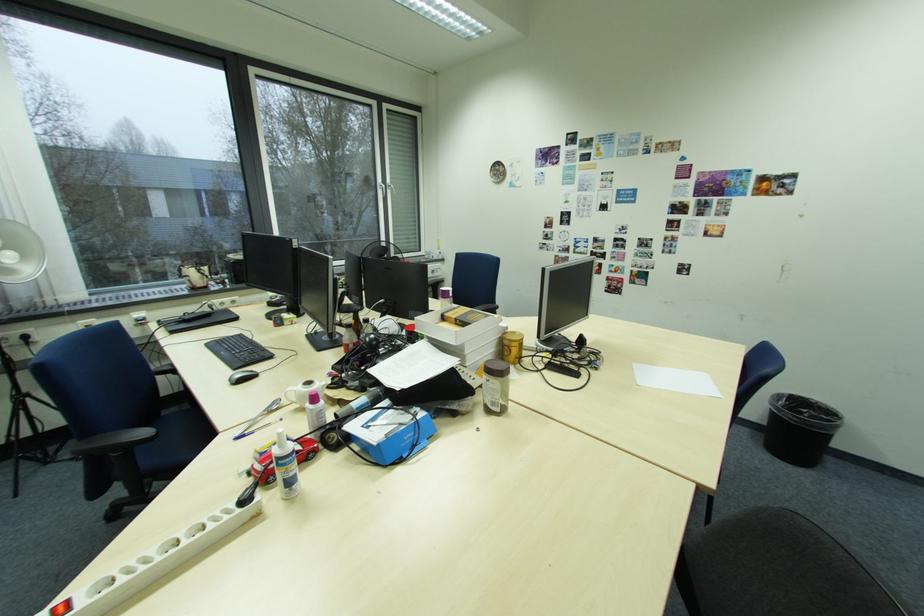
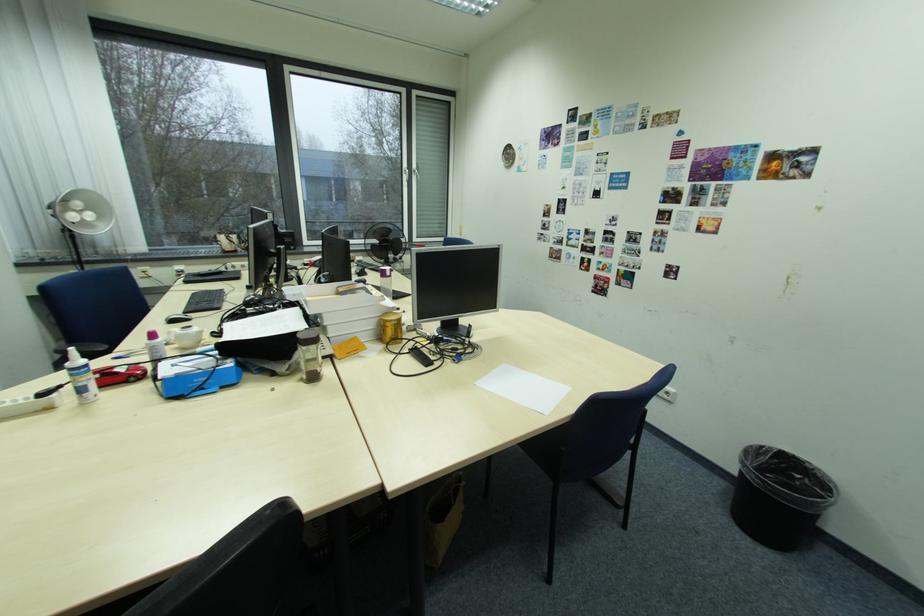
In the second image, find the point that corresponds to (x=526, y=358) in the first image.

(400, 339)